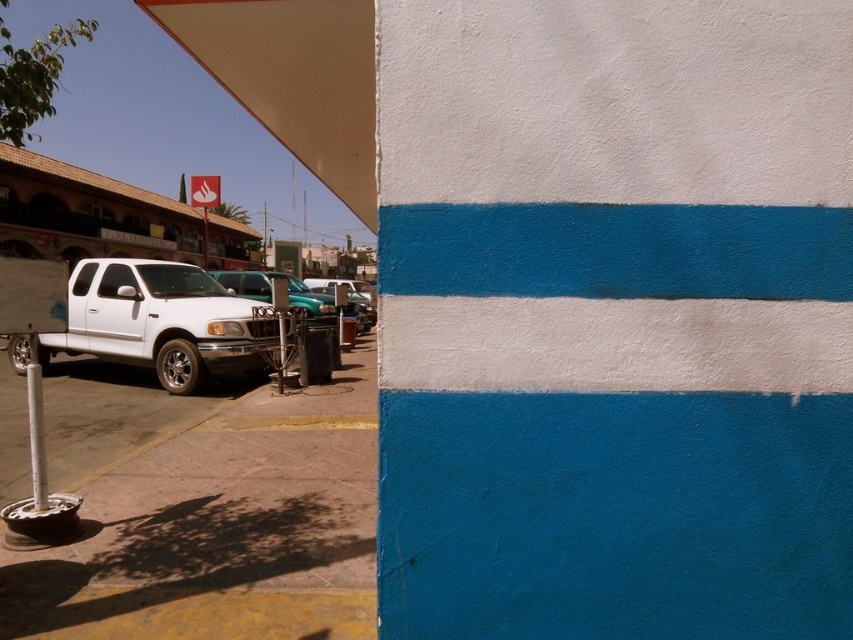
Question: Considering the real-world distances, which object is closest to the shiny silver tire at lower left?

Choices:
 (A) white painted metal pole at lower left
 (B) rubber tire at left

Answer: (B)

Question: Does matte white pickup truck at left appear on the right side of metallic teal sedan at center?

Choices:
 (A) no
 (B) yes

Answer: (A)

Question: Does metallic teal sedan at center come in front of white painted metal pole at lower left?

Choices:
 (A) no
 (B) yes

Answer: (A)

Question: Among these objects, which one is nearest to the camera?

Choices:
 (A) shiny silver tire at lower left
 (B) white painted metal pole at lower left
 (C) metallic teal sedan at center

Answer: (B)

Question: Can you confirm if matte white pickup truck at left is positioned to the right of rubber tire at left?

Choices:
 (A) no
 (B) yes

Answer: (B)

Question: Among these points, which one is nearest to the camera?

Choices:
 (A) (238, 276)
 (B) (186, 352)
 (C) (12, 340)

Answer: (B)